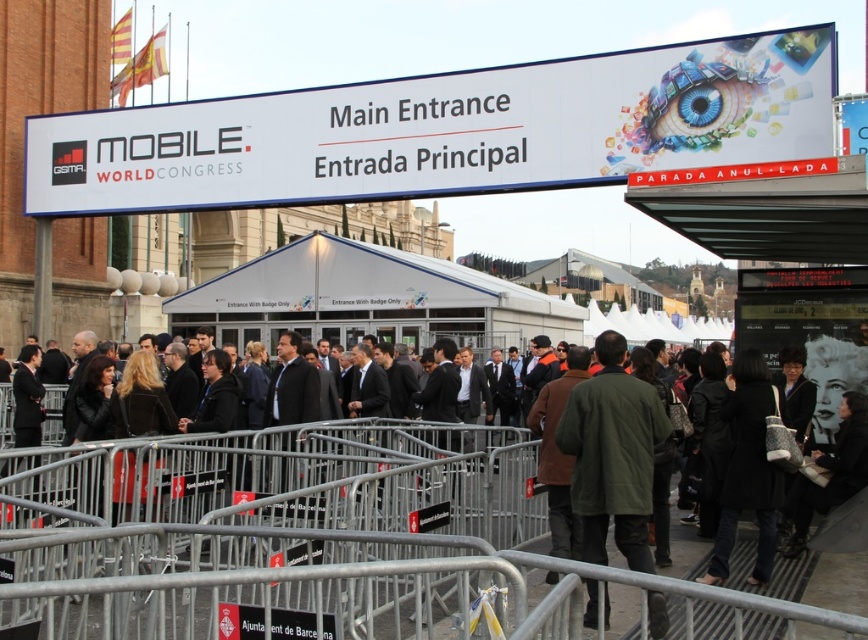
Who is more distant from viewer, (148, 484) or (222, 289)?

Point (222, 289)

From the picture: Which of these two, dark brown leather jacket at center or white fabric canopy at center, stands taller?

white fabric canopy at center

Based on the photo, who is more forward, (25, 472) or (405, 268)?

Point (25, 472) is in front.

Identify the location of dark brown leather jacket at center. This screenshot has height=640, width=868. [x=278, y=474].

Is white plastic sign at upper center above white fabric canopy at center?

Yes, white plastic sign at upper center is above white fabric canopy at center.

Is point (247, 145) closer to viewer compared to point (319, 280)?

Yes, point (247, 145) is in front of point (319, 280).

Is point (353, 132) farther from viewer compared to point (360, 307)?

No, (353, 132) is in front of (360, 307).

This screenshot has height=640, width=868. Find the location of `white plastic sign at upper center`. white plastic sign at upper center is located at coordinates (446, 131).

Which is in front, point (406, 300) or point (602, 490)?

Positioned in front is point (602, 490).

Based on the photo, can you confirm if white fabric canopy at center is positioned to the right of green matte jacket at center?

In fact, white fabric canopy at center is to the left of green matte jacket at center.

Locate an element on the screen. The width and height of the screenshot is (868, 640). white fabric canopy at center is located at coordinates (356, 284).

This screenshot has height=640, width=868. What are the coordinates of `white fabric canopy at center` in the screenshot? It's located at (356, 284).